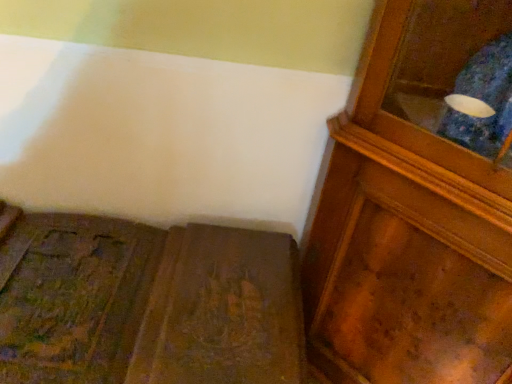
Question: From a real-world perspective, is wooden carved bench at lower left on wooden cabinet at right?

Choices:
 (A) yes
 (B) no

Answer: (B)

Question: Is wooden carved bench at lower left positioned far away from wooden cabinet at right?

Choices:
 (A) yes
 (B) no

Answer: (B)

Question: From the image's perspective, is wooden carved bench at lower left below wooden cabinet at right?

Choices:
 (A) yes
 (B) no

Answer: (A)

Question: Does wooden carved bench at lower left lie in front of wooden cabinet at right?

Choices:
 (A) no
 (B) yes

Answer: (A)

Question: Considering the relative sizes of wooden carved bench at lower left and wooden cabinet at right in the image provided, is wooden carved bench at lower left thinner than wooden cabinet at right?

Choices:
 (A) no
 (B) yes

Answer: (A)

Question: From the image's perspective, is wooden carved bench at lower left on wooden cabinet at right?

Choices:
 (A) yes
 (B) no

Answer: (B)

Question: Is wooden cabinet at right shorter than wooden carved bench at lower left?

Choices:
 (A) no
 (B) yes

Answer: (A)

Question: From a real-world perspective, is wooden cabinet at right over wooden carved bench at lower left?

Choices:
 (A) no
 (B) yes

Answer: (B)

Question: From the image's perspective, is wooden cabinet at right over wooden carved bench at lower left?

Choices:
 (A) yes
 (B) no

Answer: (A)

Question: Is the surface of wooden cabinet at right in direct contact with wooden carved bench at lower left?

Choices:
 (A) no
 (B) yes

Answer: (A)

Question: Does wooden cabinet at right have a greater width compared to wooden carved bench at lower left?

Choices:
 (A) yes
 (B) no

Answer: (B)

Question: Can wooden carved bench at lower left be found inside wooden cabinet at right?

Choices:
 (A) yes
 (B) no

Answer: (B)

Question: Considering the positions of wooden cabinet at right and wooden carved bench at lower left in the image, is wooden cabinet at right wider or thinner than wooden carved bench at lower left?

Choices:
 (A) wide
 (B) thin

Answer: (B)